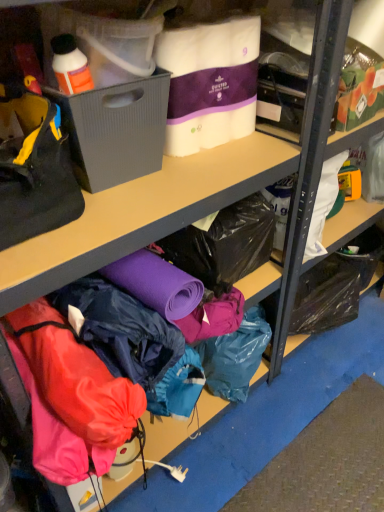
Question: Is black fabric handbag at left at the left side of white quilted paper towels at upper center, the 1th clothing when ordered from top to bottom?

Choices:
 (A) no
 (B) yes

Answer: (B)

Question: Can white quilted paper towels at upper center, the 2th clothing when ordered from bottom to top, be found inside black fabric handbag at left?

Choices:
 (A) no
 (B) yes

Answer: (A)

Question: Is black fabric handbag at left thinner than white quilted paper towels at upper center, the 1th clothing when ordered from top to bottom?

Choices:
 (A) no
 (B) yes

Answer: (A)

Question: Is there a large distance between black fabric handbag at left and white quilted paper towels at upper center, the 1th clothing when ordered from top to bottom?

Choices:
 (A) no
 (B) yes

Answer: (A)

Question: Considering the relative sizes of black fabric handbag at left and white quilted paper towels at upper center, the 1th clothing when ordered from top to bottom, in the image provided, is black fabric handbag at left bigger than white quilted paper towels at upper center, the 1th clothing when ordered from top to bottom,?

Choices:
 (A) yes
 (B) no

Answer: (A)

Question: Looking at their shapes, would you say black fabric handbag at left is wider or thinner than waterproof fabric jacket at lower center, the 2th clothing when ordered from top to bottom?

Choices:
 (A) wide
 (B) thin

Answer: (B)

Question: In terms of size, does black fabric handbag at left appear bigger or smaller than waterproof fabric jacket at lower center, positioned as the first clothing in bottom-to-top order?

Choices:
 (A) small
 (B) big

Answer: (A)

Question: From their relative heights in the image, would you say black fabric handbag at left is taller or shorter than waterproof fabric jacket at lower center, positioned as the first clothing in bottom-to-top order?

Choices:
 (A) tall
 (B) short

Answer: (B)

Question: Visually, is black fabric handbag at left positioned to the left or to the right of waterproof fabric jacket at lower center, the 2th clothing when ordered from top to bottom?

Choices:
 (A) left
 (B) right

Answer: (A)

Question: From the image's perspective, is gray plastic bin at left located above or below black fabric handbag at left?

Choices:
 (A) below
 (B) above

Answer: (B)

Question: Would you say gray plastic bin at left is inside or outside black fabric handbag at left?

Choices:
 (A) outside
 (B) inside

Answer: (A)

Question: Is point (160, 150) positioned closer to the camera than point (1, 247)?

Choices:
 (A) farther
 (B) closer

Answer: (A)

Question: In terms of size, does gray plastic bin at left appear bigger or smaller than black fabric handbag at left?

Choices:
 (A) big
 (B) small

Answer: (B)

Question: From the image's perspective, is black fabric handbag at left above or below white quilted paper towels at upper center, the 1th clothing when ordered from top to bottom?

Choices:
 (A) below
 (B) above

Answer: (A)

Question: Is black fabric handbag at left inside or outside of white quilted paper towels at upper center, the 1th clothing when ordered from top to bottom?

Choices:
 (A) inside
 (B) outside

Answer: (B)